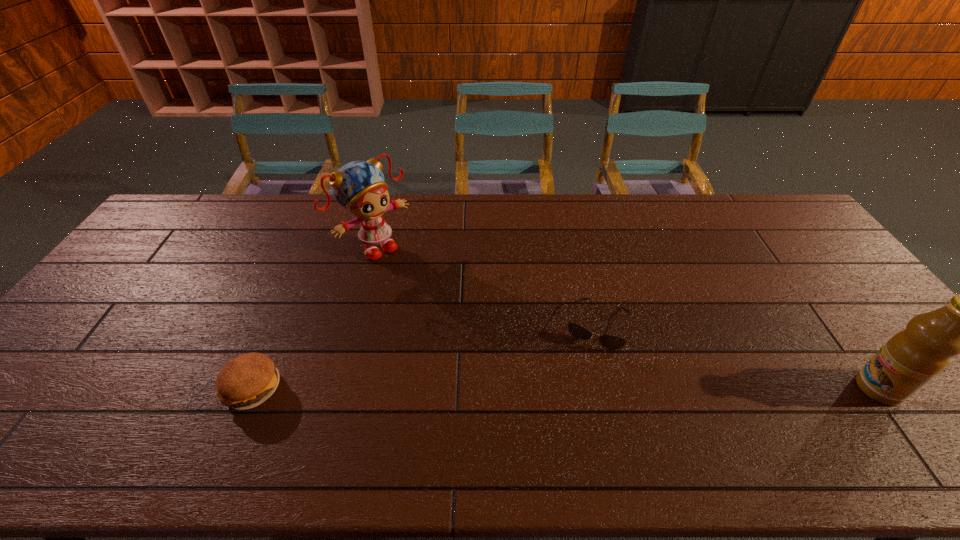
Identify the location of vacant space on the desktop that is between the leftmost object and the olive oil and is positioned on the front-facing side of the second farthest object. (576, 388).

I want to click on free space on the desktop that is between the second shortest object and the olive oil and is positioned on the face of the third object from right to left, so click(520, 388).